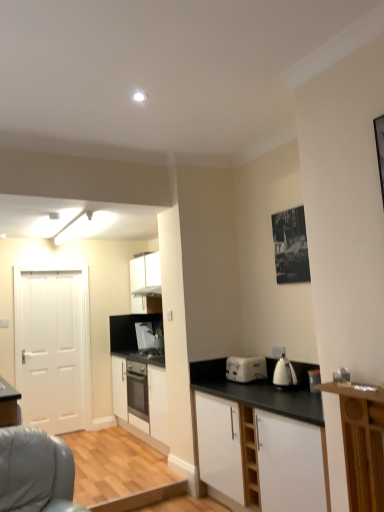
Where is `vacant area on top of white matte door at left (from a real-world perspective)`? The width and height of the screenshot is (384, 512). vacant area on top of white matte door at left (from a real-world perspective) is located at coordinates (54, 269).